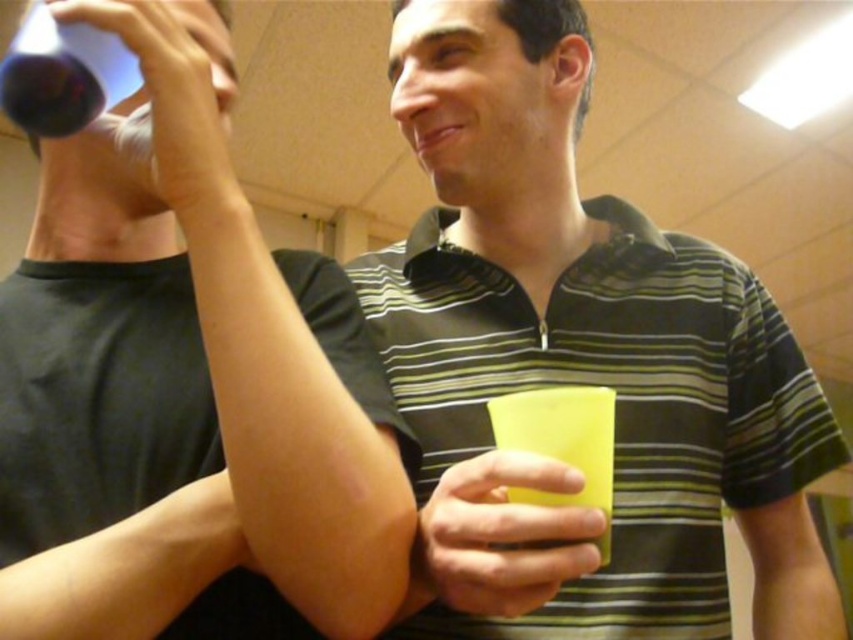
Question: Is matte plastic cup at upper left to the left of yellow matte cup at center from the viewer's perspective?

Choices:
 (A) yes
 (B) no

Answer: (A)

Question: Can you confirm if matte yellow cup at center is positioned below yellow matte cup at center?

Choices:
 (A) yes
 (B) no

Answer: (B)

Question: Which point is closer to the camera?

Choices:
 (A) yellow matte cup at lower center
 (B) matte plastic cup at upper left
 (C) translucent plastic cup at upper left

Answer: (A)

Question: Which object appears closest to the camera in this image?

Choices:
 (A) matte yellow cup at center
 (B) matte plastic cup at upper left
 (C) yellow matte cup at center

Answer: (A)

Question: Which point is farther to the camera?

Choices:
 (A) yellow matte cup at lower center
 (B) yellow matte cup at center
 (C) matte yellow cup at center

Answer: (B)

Question: Is matte green cup at right wider than yellow matte cup at lower center?

Choices:
 (A) yes
 (B) no

Answer: (A)